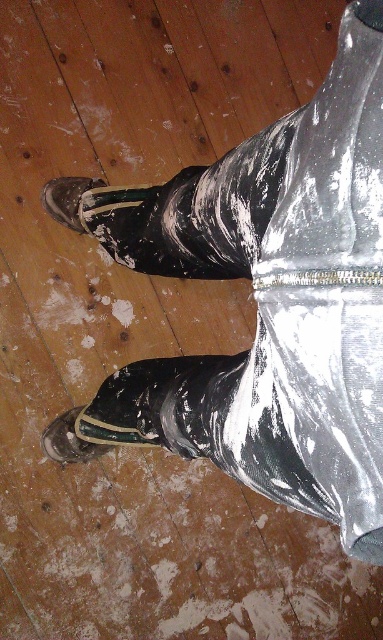
Question: Can you confirm if shiny black shoe at lower left is thinner than matte black shoe at lower left?

Choices:
 (A) yes
 (B) no

Answer: (B)

Question: Where is shiny black shoe at lower left located in relation to matte black shoe at lower left in the image?

Choices:
 (A) above
 (B) below

Answer: (B)

Question: Is shiny black shoe at lower left thinner than matte black shoe at lower left?

Choices:
 (A) yes
 (B) no

Answer: (B)

Question: Among these points, which one is farthest from the camera?

Choices:
 (A) click(114, 445)
 (B) click(62, 179)

Answer: (B)